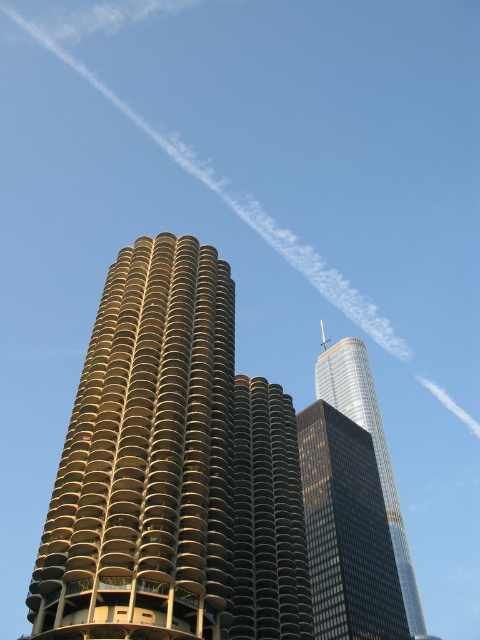
Question: Is dark gray concrete building at center bigger than shiny glass skyscraper at upper right?

Choices:
 (A) yes
 (B) no

Answer: (B)

Question: Which object is farther from the camera taking this photo?

Choices:
 (A) dark gray concrete building at center
 (B) shiny glass skyscraper at upper right

Answer: (B)

Question: Can you confirm if gold metallic building at center is thinner than shiny glass skyscraper at upper right?

Choices:
 (A) yes
 (B) no

Answer: (A)

Question: Considering the real-world distances, which object is closest to the gold metallic building at center?

Choices:
 (A) shiny glass skyscraper at upper right
 (B) dark gray concrete building at center

Answer: (B)

Question: Which point is closer to the camera?

Choices:
 (A) dark gray concrete building at center
 (B) gold metallic building at center

Answer: (B)

Question: Is gold metallic building at center thinner than dark gray concrete building at center?

Choices:
 (A) yes
 (B) no

Answer: (B)